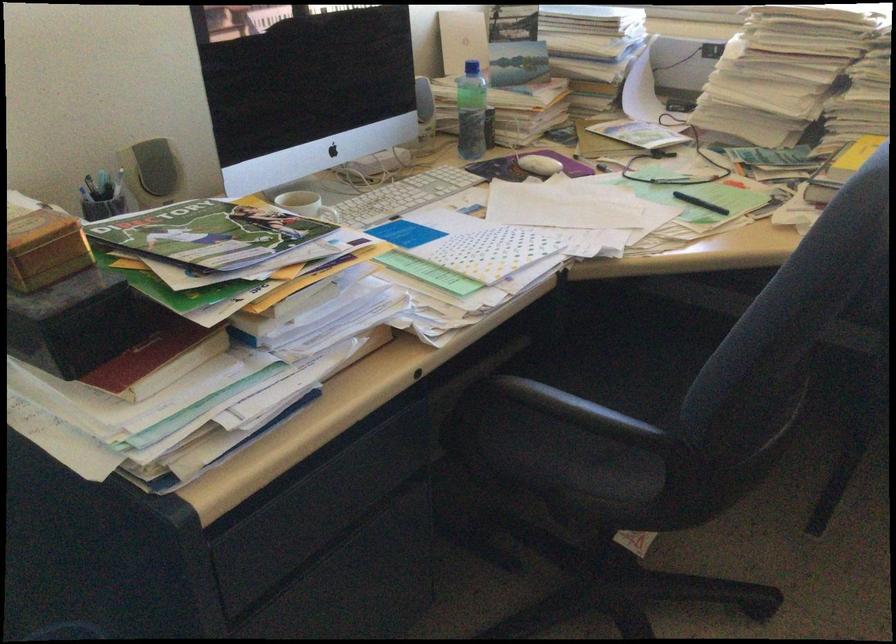
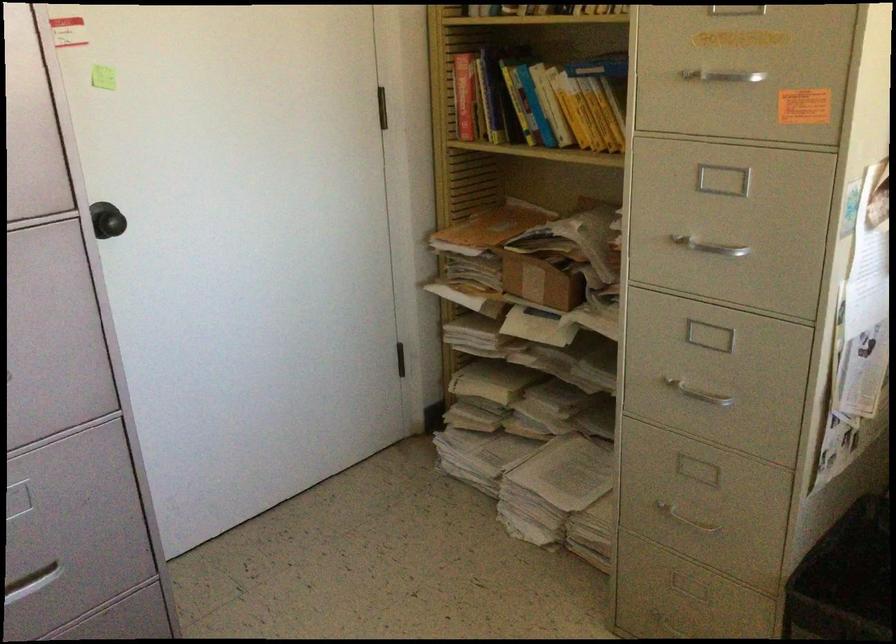
Based on the continuous images, in which direction is the camera rotating?

The camera rotated toward left-down.